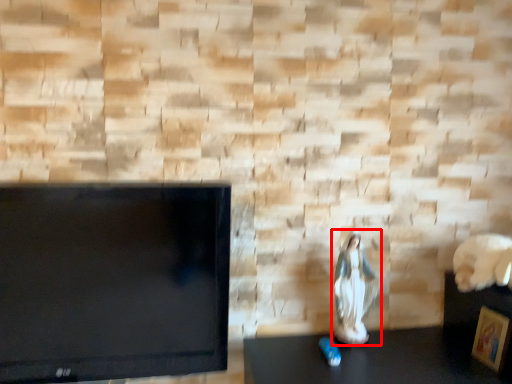
Question: From the image's perspective, where is couple (annotated by the red box) located relative to picture frame?

Choices:
 (A) above
 (B) below

Answer: (A)